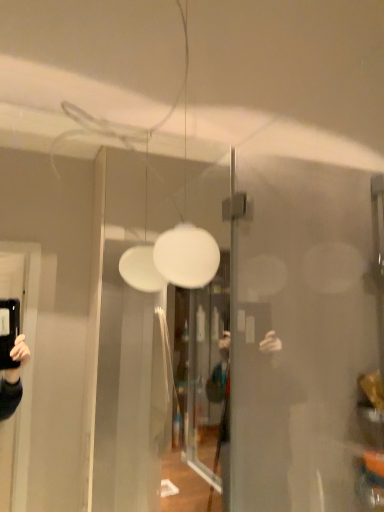
Describe the element at coordinates (186, 233) in the screenshot. The width and height of the screenshot is (384, 512). I see `white matte sphere at center` at that location.

The height and width of the screenshot is (512, 384). In order to click on white matte sphere at center in this screenshot , I will do `click(186, 233)`.

Describe the element at coordinates (124, 345) in the screenshot. I see `transparent glass door at center` at that location.

Identify the location of transparent glass door at center. (124, 345).

You are a GUI agent. You are given a task and a screenshot of the screen. Output one action in this format:
    pyautogui.click(x=<x>, y=<y>)
    Task: Click on the white matte sphere at center
    This screenshot has height=512, width=384.
    Given the screenshot: What is the action you would take?
    pyautogui.click(x=186, y=233)

Which is more to the left, transparent glass door at center or white matte sphere at center?

Positioned to the left is transparent glass door at center.

In the image, is transparent glass door at center positioned in front of or behind white matte sphere at center?

Visually, transparent glass door at center is located in front of white matte sphere at center.

Is point (119, 224) positioned behind point (190, 253)?

Yes, it is.

From the image's perspective, is transparent glass door at center above or below white matte sphere at center?

transparent glass door at center is below white matte sphere at center.

From a real-world perspective, is transparent glass door at center positioned over white matte sphere at center based on gravity?

Incorrect, from a real-world perspective, transparent glass door at center is lower than white matte sphere at center.

Considering the relative sizes of transparent glass door at center and white matte sphere at center in the image provided, is transparent glass door at center thinner than white matte sphere at center?

Yes.

From their relative heights in the image, would you say transparent glass door at center is taller or shorter than white matte sphere at center?

Considering their sizes, transparent glass door at center has more height than white matte sphere at center.

Does transparent glass door at center have a smaller size compared to white matte sphere at center?

Incorrect, transparent glass door at center is not smaller in size than white matte sphere at center.

Is transparent glass door at center situated inside white matte sphere at center or outside?

transparent glass door at center is not enclosed by white matte sphere at center.

Is transparent glass door at center touching white matte sphere at center?

No, transparent glass door at center is not touching white matte sphere at center.

Does transparent glass door at center turn towards white matte sphere at center?

Yes, transparent glass door at center is facing white matte sphere at center.

From the picture: How different are the orientations of transparent glass door at center and white matte sphere at center in degrees?

There is a 0.283-degree angle between the facing directions of transparent glass door at center and white matte sphere at center.

Where is `glass door in front of the white matte sphere at center`? Image resolution: width=384 pixels, height=512 pixels. glass door in front of the white matte sphere at center is located at coordinates (124, 345).

Is white matte sphere at center to the left of transparent glass door at center from the viewer's perspective?

In fact, white matte sphere at center is to the right of transparent glass door at center.

Which object is closer to the camera, white matte sphere at center or transparent glass door at center?

transparent glass door at center.

Considering the points (173, 273) and (147, 467), which point is behind, point (173, 273) or point (147, 467)?

Point (147, 467)

From the image's perspective, between white matte sphere at center and transparent glass door at center, who is located below?

From the image's view, transparent glass door at center is below.

From a real-world perspective, is white matte sphere at center above or below transparent glass door at center?

white matte sphere at center is above transparent glass door at center.

Which of these two, white matte sphere at center or transparent glass door at center, is thinner?

transparent glass door at center is thinner.

Which of these two, white matte sphere at center or transparent glass door at center, stands shorter?

white matte sphere at center is shorter.

Between white matte sphere at center and transparent glass door at center, which one has smaller size?

white matte sphere at center.

Would you say white matte sphere at center is outside transparent glass door at center?

Yes, white matte sphere at center is not within transparent glass door at center.

Is white matte sphere at center next to transparent glass door at center?

No.

Is white matte sphere at center facing away from transparent glass door at center?

Yes, transparent glass door at center is at the back of white matte sphere at center.

Measure the distance between white matte sphere at center and transparent glass door at center.

white matte sphere at center is 5.60 feet away from transparent glass door at center.

Find the location of `glass door that is below the white matte sphere at center (from the image's perspective)`. glass door that is below the white matte sphere at center (from the image's perspective) is located at coordinates (124, 345).

The height and width of the screenshot is (512, 384). What are the coordinates of `light fixture above the transparent glass door at center (from a real-world perspective)` in the screenshot? It's located at (186, 233).

Where is `glass door that is in front of the white matte sphere at center`? glass door that is in front of the white matte sphere at center is located at coordinates (124, 345).